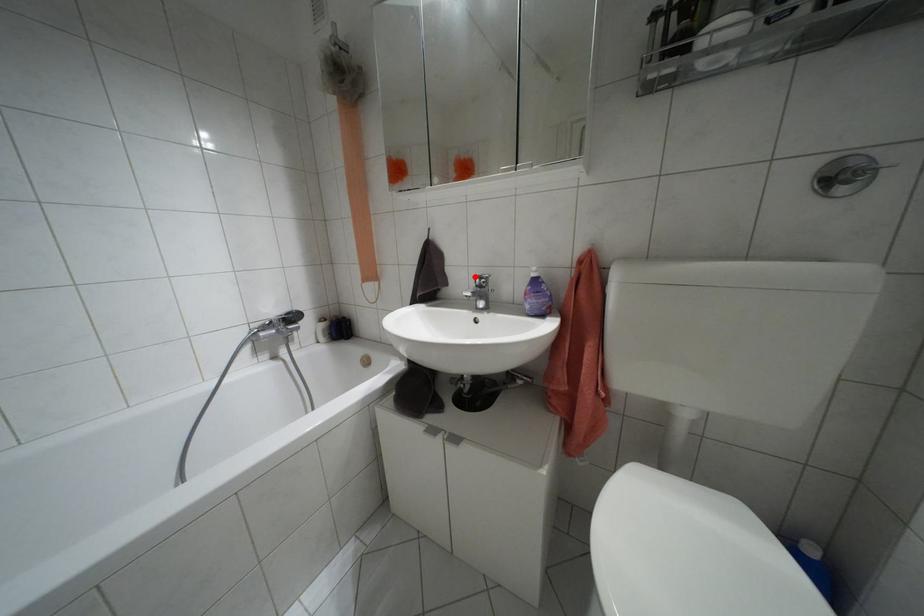
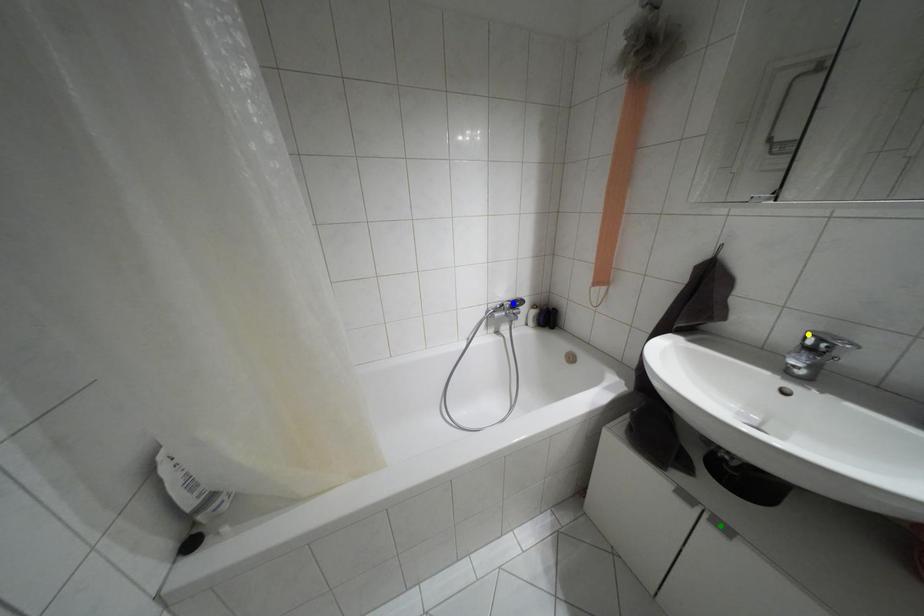
Question: I am providing you with two images of the same scene from different viewpoints. A red point is marked on the first image. You are given multiple points on the second image. Can you choose the point in image 2 that corresponds to the point in image 1?

Choices:
 (A) yellow point
 (B) green point
 (C) blue point

Answer: (A)